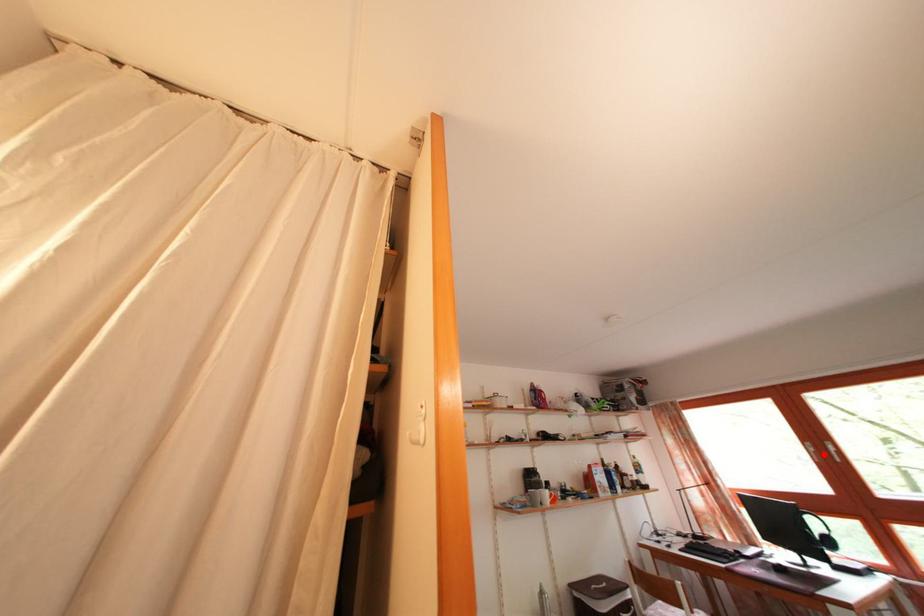
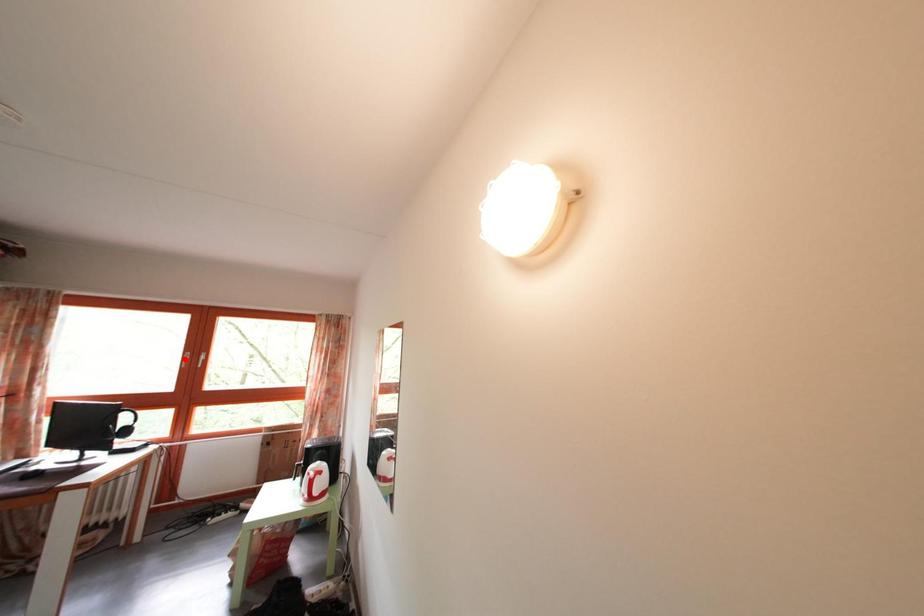
I am providing you with two images of the same scene from different viewpoints. A red point is marked on the first image and another point is marked on the second image. Is the red point in image1 aligned with the point shown in image2?

No